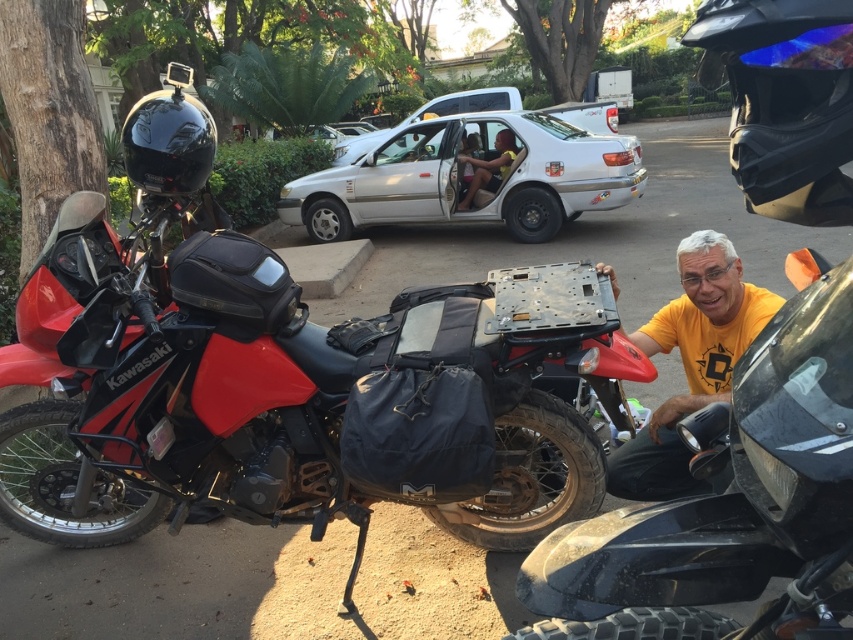
Question: Among these objects, which one is nearest to the camera?

Choices:
 (A) black glossy helmet at upper left
 (B) black matte helmet at upper right

Answer: (B)

Question: Is black matte helmet at upper right to the right of black glossy helmet at upper left from the viewer's perspective?

Choices:
 (A) no
 (B) yes

Answer: (B)

Question: Can you confirm if black matte helmet at upper right is positioned above yellow matte shirt at center?

Choices:
 (A) yes
 (B) no

Answer: (A)

Question: Which object is farther from the camera taking this photo?

Choices:
 (A) matte black helmet at upper left
 (B) black matte helmet at upper right

Answer: (A)

Question: Considering the real-world distances, which object is farthest from the black glossy helmet at upper left?

Choices:
 (A) black matte helmet at upper right
 (B) silver metallic car at center
 (C) yellow matte shirt at center

Answer: (B)

Question: Can you confirm if silver metallic car at center is positioned below matte black helmet at upper left?

Choices:
 (A) yes
 (B) no

Answer: (A)